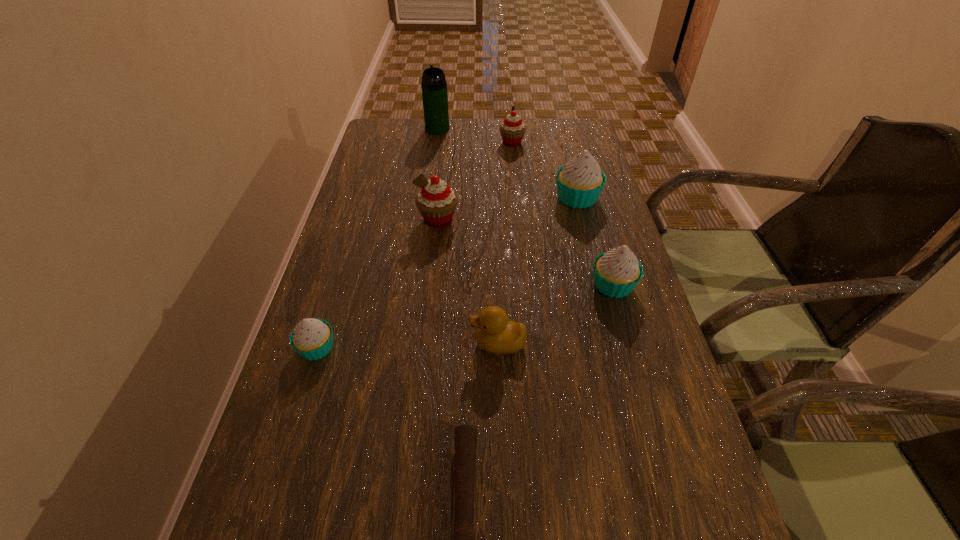
Where is `vacant area situated on the right of the nearest cupcake`? Image resolution: width=960 pixels, height=540 pixels. vacant area situated on the right of the nearest cupcake is located at coordinates (430, 348).

Locate an element on the screen. This screenshot has height=540, width=960. thermos bottle that is at the far edge is located at coordinates (434, 86).

Identify the location of cupcake at the far edge. (512, 129).

Image resolution: width=960 pixels, height=540 pixels. I want to click on object that is at the left edge, so click(312, 339).

The image size is (960, 540). What are the coordinates of `vacant space at the far edge of the desktop` in the screenshot? It's located at (473, 126).

Locate an element on the screen. This screenshot has height=540, width=960. vacant space at the left edge of the desktop is located at coordinates (309, 373).

Find the location of `free space at the right edge of the desktop`. free space at the right edge of the desktop is located at coordinates (595, 212).

This screenshot has width=960, height=540. In order to click on vacant space at the far left corner of the desktop in this screenshot , I will do `click(417, 133)`.

Where is `vacant space at the far right corner of the desktop`? vacant space at the far right corner of the desktop is located at coordinates click(x=550, y=130).

Identify the location of free space between the thermos bottle and the right pink cupcake. pyautogui.click(x=474, y=136).